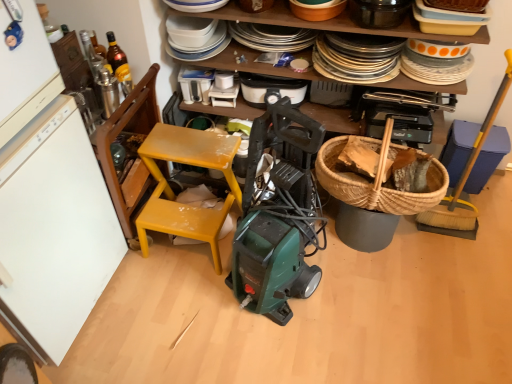
Question: Can you confirm if woven brown picnic basket at right is shorter than translucent glass bottle at upper left?

Choices:
 (A) no
 (B) yes

Answer: (B)

Question: Could you tell me if woven brown picnic basket at right is facing translucent glass bottle at upper left?

Choices:
 (A) yes
 (B) no

Answer: (B)

Question: Can translucent glass bottle at upper left be found inside woven brown picnic basket at right?

Choices:
 (A) yes
 (B) no

Answer: (B)

Question: From the image's perspective, is woven brown picnic basket at right over translucent glass bottle at upper left?

Choices:
 (A) no
 (B) yes

Answer: (A)

Question: Is woven brown picnic basket at right not near translucent glass bottle at upper left?

Choices:
 (A) no
 (B) yes

Answer: (B)

Question: Is yellow matte chair at center to the left or to the right of white matte refrigerator at left in the image?

Choices:
 (A) left
 (B) right

Answer: (B)

Question: Relative to white matte refrigerator at left, is yellow matte chair at center in front or behind?

Choices:
 (A) behind
 (B) front

Answer: (A)

Question: Is point (167, 213) closer or farther from the camera than point (27, 281)?

Choices:
 (A) closer
 (B) farther

Answer: (B)

Question: Choose the correct answer: Is yellow matte chair at center inside white matte refrigerator at left or outside it?

Choices:
 (A) inside
 (B) outside

Answer: (B)

Question: Considering the positions of point 208,77 and point 253,105, is point 208,77 closer or farther from the camera than point 253,105?

Choices:
 (A) farther
 (B) closer

Answer: (A)

Question: From a real-world perspective, is white plastic container at upper center, the 6th appliance viewed from the right, positioned above or below black plastic vacuum cleaner at center, placed as the fourth appliance when sorted from left to right?

Choices:
 (A) below
 (B) above

Answer: (B)

Question: Is white plastic container at upper center, the 6th appliance viewed from the right, wider or thinner than black plastic vacuum cleaner at center, placed as the fourth appliance when sorted from left to right?

Choices:
 (A) wide
 (B) thin

Answer: (A)

Question: Considering the relative positions of white plastic container at upper center, the 6th appliance viewed from the right, and black plastic vacuum cleaner at center, placed as the fourth appliance when sorted from left to right, in the image provided, is white plastic container at upper center, the 6th appliance viewed from the right, to the left or to the right of black plastic vacuum cleaner at center, placed as the fourth appliance when sorted from left to right,?

Choices:
 (A) left
 (B) right

Answer: (A)

Question: From the image's perspective, is white plastic container at upper center, which appears as the second appliance when viewed from the left, located above or below metallic silver thermos at upper left, the seventh appliance in the right-to-left sequence?

Choices:
 (A) below
 (B) above

Answer: (B)

Question: From a real-world perspective, is white plastic container at upper center, the 6th appliance viewed from the right, physically located above or below metallic silver thermos at upper left, the seventh appliance in the right-to-left sequence?

Choices:
 (A) below
 (B) above

Answer: (A)